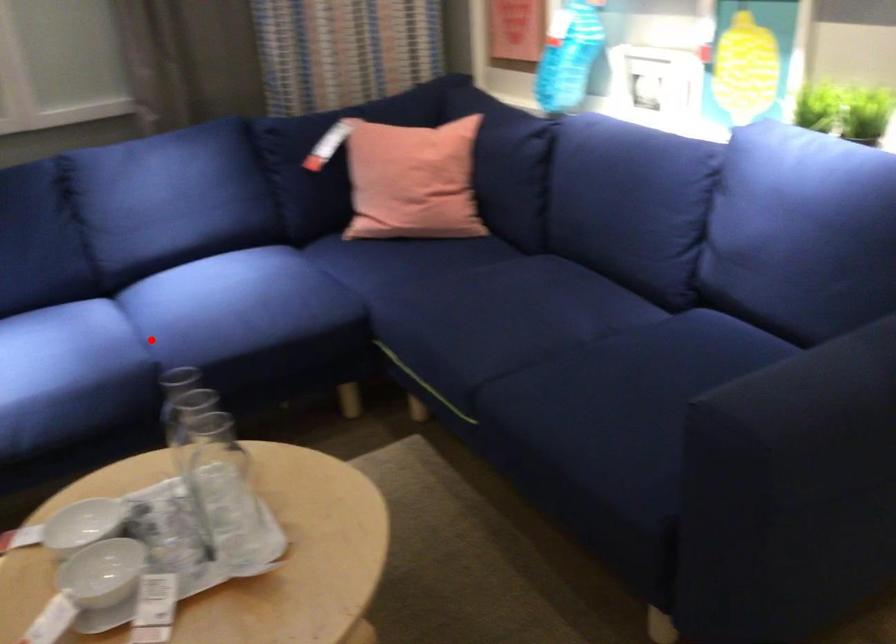
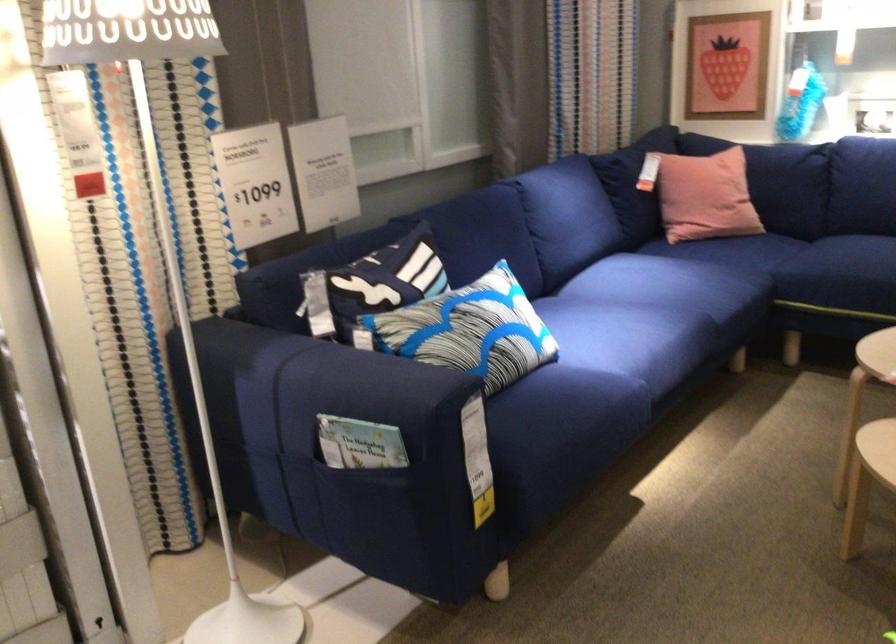
Question: A red point is marked in image1. In image2, is the corresponding 3D point closer to the camera or farther? Reply with the corresponding letter.

Choices:
 (A) The corresponding 3D point is closer.
 (B) The corresponding 3D point is farther.

Answer: (B)